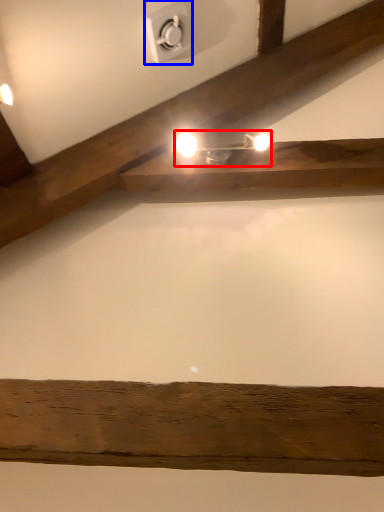
Question: Which object is further to the camera taking this photo, lamp (highlighted by a red box) or electric outlet (highlighted by a blue box)?

Choices:
 (A) lamp
 (B) electric outlet

Answer: (A)